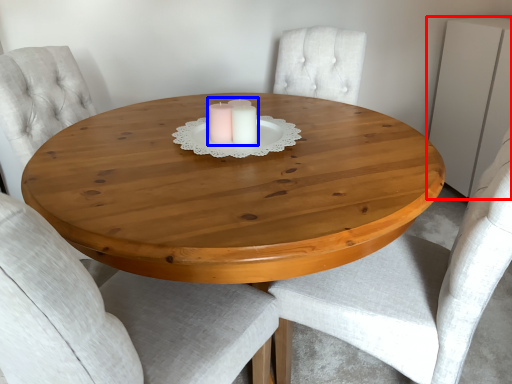
Question: Which of the following is the farthest to the observer, dresser (highlighted by a red box) or candle holder (highlighted by a blue box)?

Choices:
 (A) dresser
 (B) candle holder

Answer: (A)